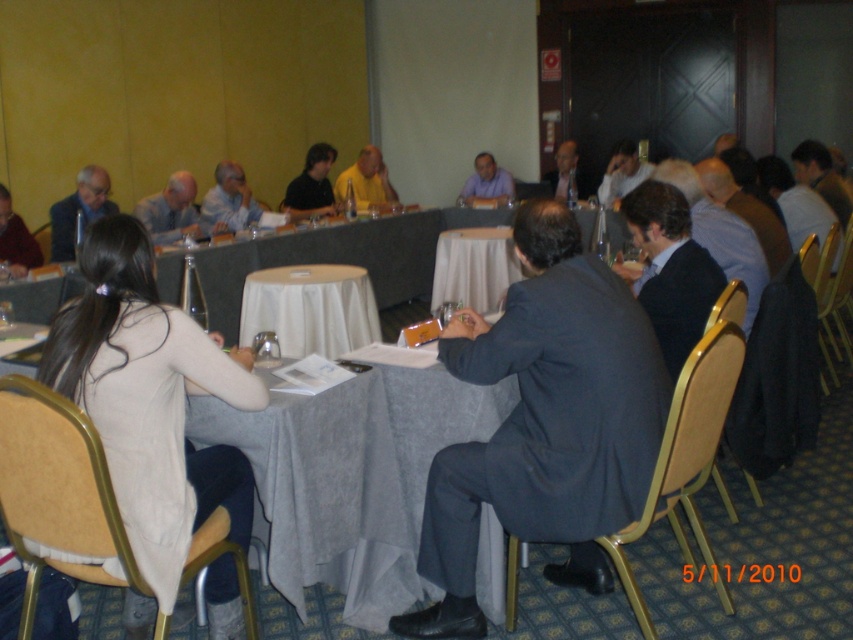
Is dark blue shirt at center positioned in front of yellow matte shirt at center?

Yes, dark blue shirt at center is closer to the viewer.

Looking at this image, is dark blue shirt at center shorter than yellow matte shirt at center?

Incorrect, dark blue shirt at center's height does not fall short of yellow matte shirt at center's.

Identify the location of dark blue shirt at center. This screenshot has width=853, height=640. (312, 184).

Where is `dark blue shirt at center`? The width and height of the screenshot is (853, 640). dark blue shirt at center is located at coordinates (312, 184).

Which is below, dark gray suit at center or matte black shirt at center?

dark gray suit at center

Based on the photo, can you confirm if dark gray suit at center is positioned above matte black shirt at center?

No, dark gray suit at center is not above matte black shirt at center.

Find the location of a particular element. This screenshot has width=853, height=640. dark gray suit at center is located at coordinates (544, 422).

Which is behind, point (183, 342) or point (308, 352)?

The point (308, 352) is behind.

This screenshot has width=853, height=640. In order to click on white sweater at center in this screenshot , I will do `click(155, 412)`.